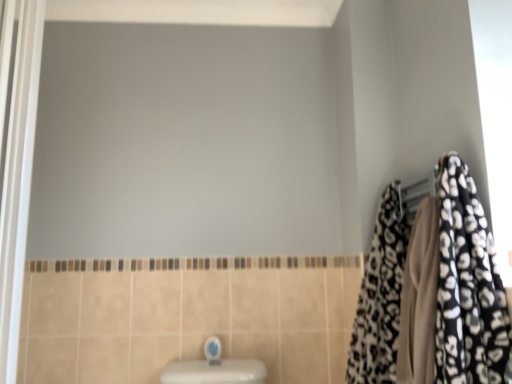
Question: Can you confirm if leopard print fabric at right is wider than blue glossy faucet at lower center?

Choices:
 (A) no
 (B) yes

Answer: (B)

Question: Can you confirm if leopard print fabric at right is positioned to the left of blue glossy faucet at lower center?

Choices:
 (A) no
 (B) yes

Answer: (A)

Question: From the image's perspective, is leopard print fabric at right beneath blue glossy faucet at lower center?

Choices:
 (A) yes
 (B) no

Answer: (B)

Question: From a real-world perspective, is leopard print fabric at right below blue glossy faucet at lower center?

Choices:
 (A) no
 (B) yes

Answer: (A)

Question: Does leopard print fabric at right have a greater height compared to blue glossy faucet at lower center?

Choices:
 (A) yes
 (B) no

Answer: (A)

Question: Is there a large distance between leopard print fabric at right and blue glossy faucet at lower center?

Choices:
 (A) no
 (B) yes

Answer: (A)

Question: Is leopard print fabric at right thinner than white glossy screen door at left?

Choices:
 (A) yes
 (B) no

Answer: (B)

Question: Considering the relative sizes of leopard print fabric at right and white glossy screen door at left in the image provided, is leopard print fabric at right bigger than white glossy screen door at left?

Choices:
 (A) no
 (B) yes

Answer: (B)

Question: Can you confirm if leopard print fabric at right is positioned to the left of white glossy screen door at left?

Choices:
 (A) yes
 (B) no

Answer: (B)

Question: Does leopard print fabric at right come behind white glossy screen door at left?

Choices:
 (A) yes
 (B) no

Answer: (B)

Question: Considering the relative sizes of leopard print fabric at right and white glossy screen door at left in the image provided, is leopard print fabric at right shorter than white glossy screen door at left?

Choices:
 (A) no
 (B) yes

Answer: (B)

Question: Are leopard print fabric at right and white glossy screen door at left beside each other?

Choices:
 (A) yes
 (B) no

Answer: (B)

Question: Considering the relative sizes of leopard print towel at right and white glossy screen door at left in the image provided, is leopard print towel at right taller than white glossy screen door at left?

Choices:
 (A) yes
 (B) no

Answer: (B)